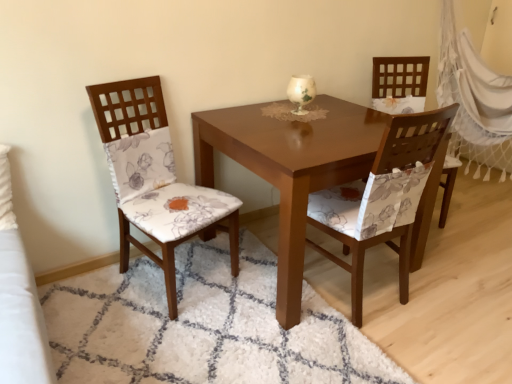
Identify the location of free location to the right of matte floral fabric chair at center, placed as the 2th chair when sorted from left to right. The width and height of the screenshot is (512, 384). (451, 297).